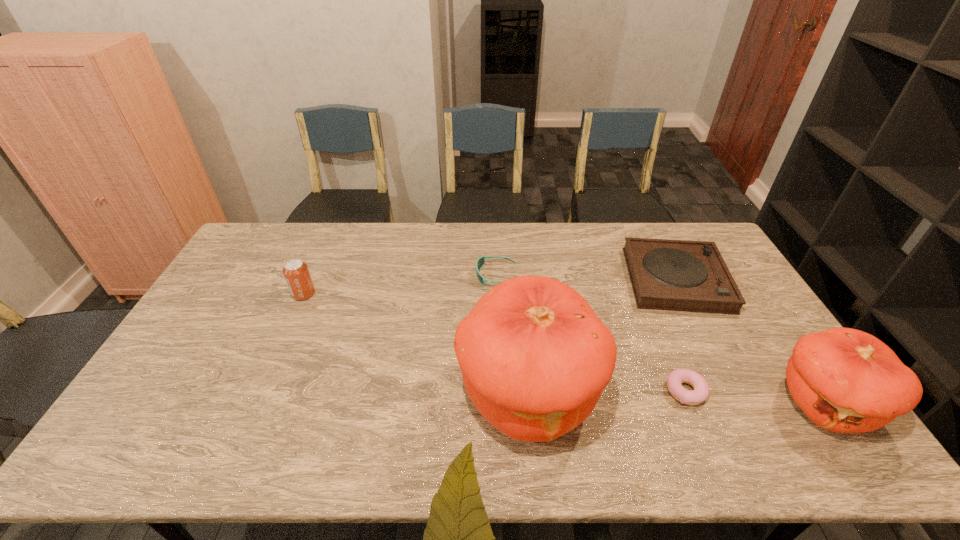
Image resolution: width=960 pixels, height=540 pixels. Find the location of `vacant space that satisfies the following two spatial constraints: 1. on the front-facing side of the sunglasses; 2. on the right side of the second tallest object`. vacant space that satisfies the following two spatial constraints: 1. on the front-facing side of the sunglasses; 2. on the right side of the second tallest object is located at coordinates (502, 404).

Find the location of `blank space that satisfies the following two spatial constraints: 1. on the front-facing side of the phonograph record; 2. on the right side of the sunglasses`. blank space that satisfies the following two spatial constraints: 1. on the front-facing side of the phonograph record; 2. on the right side of the sunglasses is located at coordinates (496, 279).

The height and width of the screenshot is (540, 960). I want to click on vacant space that satisfies the following two spatial constraints: 1. on the front-facing side of the sunglasses; 2. on the right side of the taller pumpkin, so click(x=501, y=394).